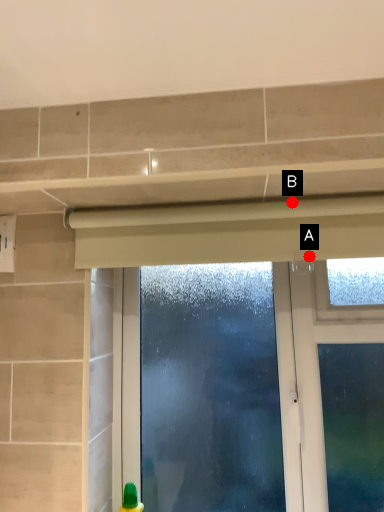
Question: Two points are circled on the image, labeled by A and B beside each circle. Which point is closer to the camera?

Choices:
 (A) A is closer
 (B) B is closer

Answer: (A)